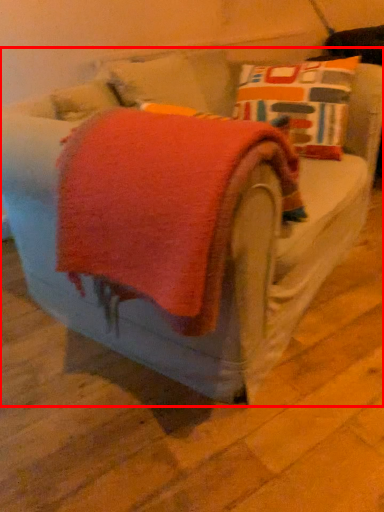
Question: Where is furniture (annotated by the red box) located in relation to bath towel in the image?

Choices:
 (A) right
 (B) left

Answer: (A)